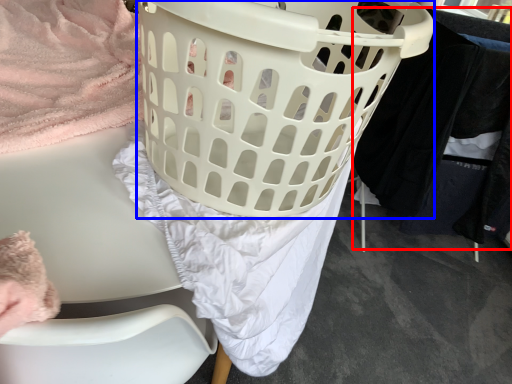
Question: Which object is further to the camera taking this photo, clothing (highlighted by a red box) or basket (highlighted by a blue box)?

Choices:
 (A) clothing
 (B) basket

Answer: (A)